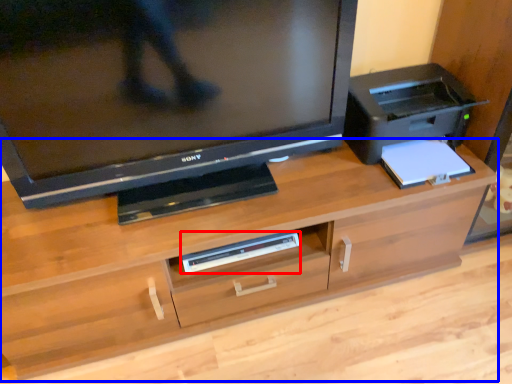
Question: Which point is closer to the camera, equipment (highlighted by a red box) or desk (highlighted by a blue box)?

Choices:
 (A) equipment
 (B) desk

Answer: (B)